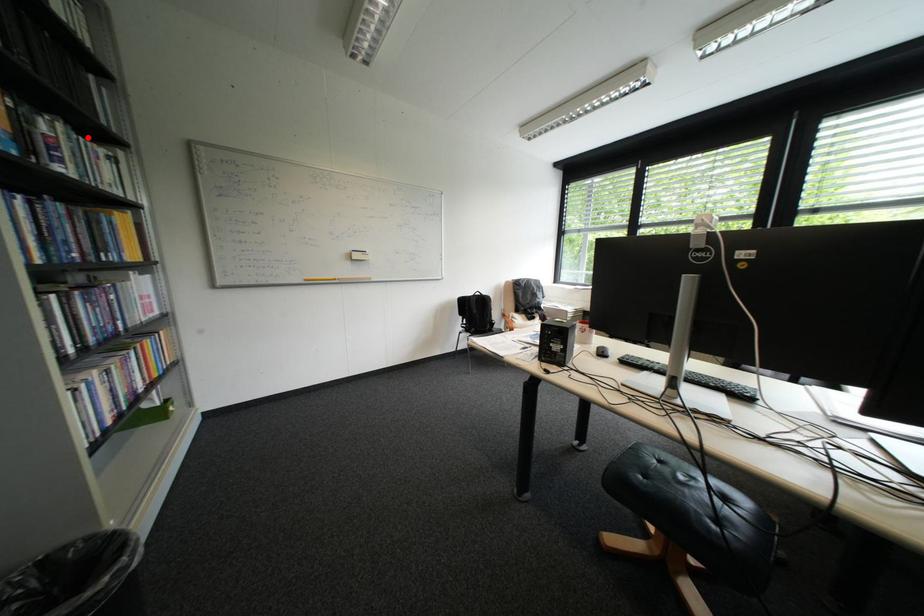
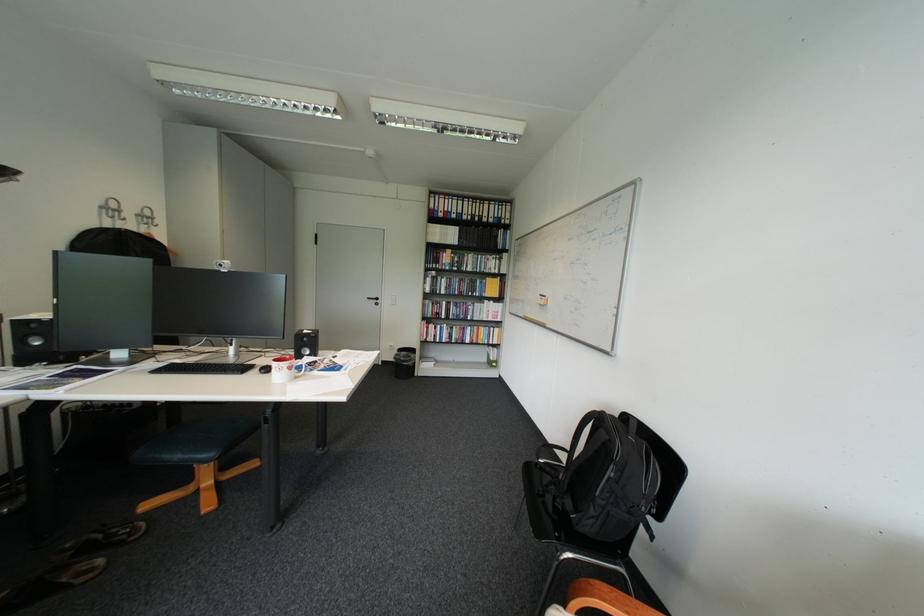
Find the pixel in the second image that matches the highlighted location in the first image.

(489, 257)